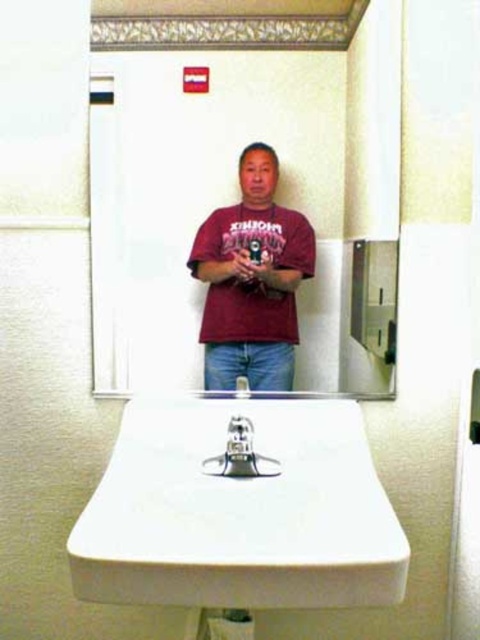
You are a photographer standing in front of the bathroom sink. You want to capture a photo of the matte maroon shirt at center and the white glossy sink at lower center in the same frame. Given their distance apart, will both objects fit in the camera viewfinder if the viewfinder has a width of 12 inches?

The matte maroon shirt at center and white glossy sink at lower center are 13.13 inches apart. Since the distance between them exceeds the viewfinder width of 12 inches, both objects will not fit in the camera viewfinder.